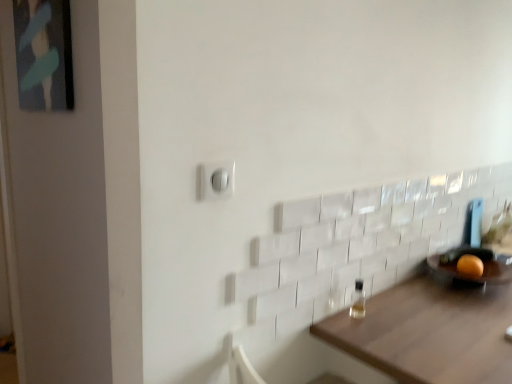
Question: Which is correct: matte black picture frame at upper left is inside brown wooden table at lower right, or outside of it?

Choices:
 (A) inside
 (B) outside

Answer: (B)

Question: Does point (42, 89) appear closer or farther from the camera than point (440, 357)?

Choices:
 (A) farther
 (B) closer

Answer: (A)

Question: Which of these objects is positioned farthest from the white plastic light switch at center?

Choices:
 (A) orange matte at right
 (B) brown wooden table at lower right
 (C) transparent glass bottle at lower right
 (D) matte black picture frame at upper left

Answer: (A)

Question: Which object is the closest to the transparent glass bottle at lower right?

Choices:
 (A) orange matte at right
 (B) white plastic light switch at center
 (C) matte black picture frame at upper left
 (D) brown wooden table at lower right

Answer: (D)